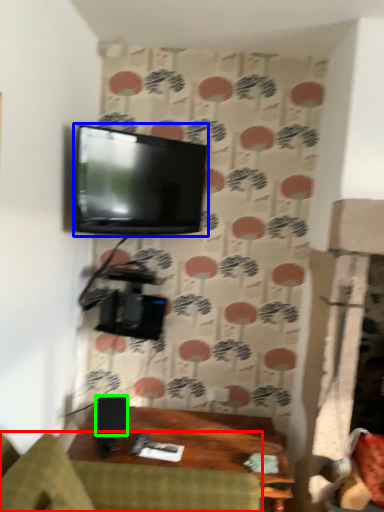
Question: Which object is the farthest from studio couch (highlighted by a red box)? Choose among these: television (highlighted by a blue box) or speaker (highlighted by a green box).

Choices:
 (A) television
 (B) speaker

Answer: (A)